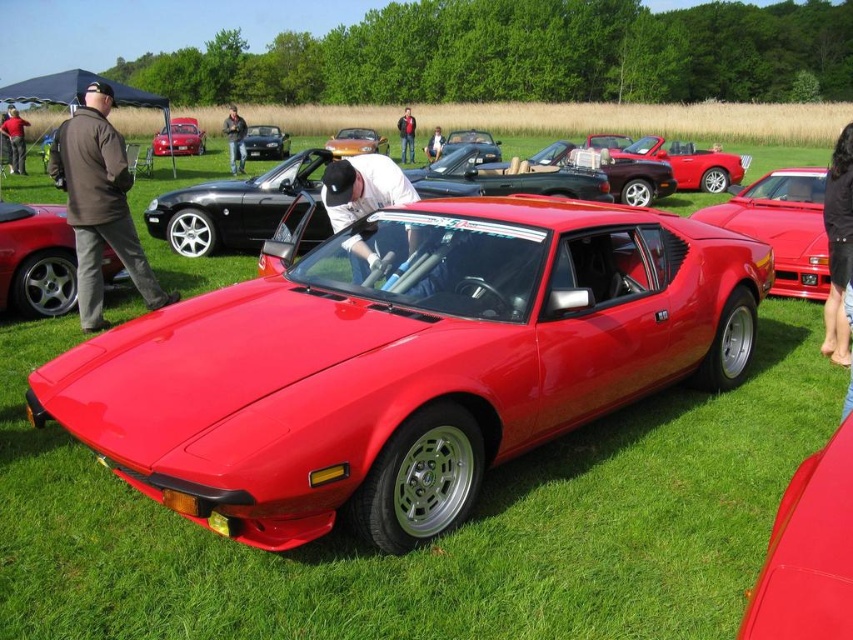
You are at the car show and want to take a photo of both the shiny red convertible at center and the dark brown leather jacket at left. Which object should you focus on first to ensure both are in the frame?

The shiny red convertible at center is positioned on the right side of dark brown leather jacket at left, so you should focus on the dark brown leather jacket at left first to ensure both are in the frame.

You are a photographer standing in front of the shiny metallic car at center and the shiny metallic convertible at center. You want to take a photo that includes both vehicles but ensure the one closer to you is in focus. Which vehicle should you focus on?

You should focus on the shiny metallic car at center because it is closer to you than the shiny metallic convertible at center.